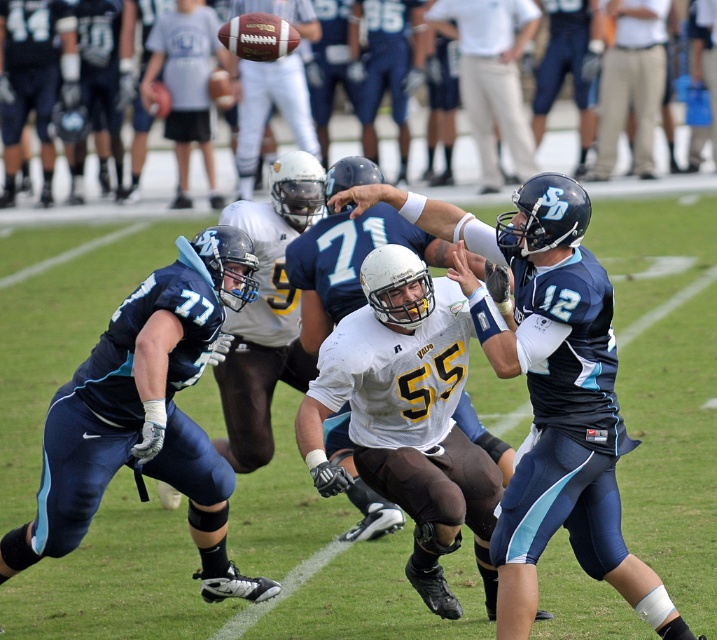
Is light blue jersey at center to the left of matte gray helmet at upper center from the viewer's perspective?

In fact, light blue jersey at center is to the right of matte gray helmet at upper center.

Is light blue jersey at center positioned behind matte gray helmet at upper center?

No, light blue jersey at center is closer to the viewer.

Describe the element at coordinates (490, 76) in the screenshot. I see `light blue jersey at center` at that location.

Where is `light blue jersey at center`? The height and width of the screenshot is (640, 717). light blue jersey at center is located at coordinates (490, 76).

Does matte blue uniform at center lie behind light blue jersey at center?

No, matte blue uniform at center is in front of light blue jersey at center.

What are the coordinates of `matte blue uniform at center` in the screenshot? It's located at (143, 417).

Is point (219, 586) positioned before point (523, 125)?

Yes, point (219, 586) is in front of point (523, 125).

Where is `matte blue uniform at center`? This screenshot has width=717, height=640. matte blue uniform at center is located at coordinates (143, 417).

Does matte blue uniform at center appear over matte gray helmet at upper center?

Incorrect, matte blue uniform at center is not positioned above matte gray helmet at upper center.

Is point (212, 296) farther from camera compared to point (75, 173)?

That is False.

You are a GUI agent. You are given a task and a screenshot of the screen. Output one action in this format:
    pyautogui.click(x=<x>, y=<y>)
    Task: Click on the matte blue uniform at center
    This screenshot has width=717, height=640.
    Given the screenshot: What is the action you would take?
    pyautogui.click(x=143, y=417)